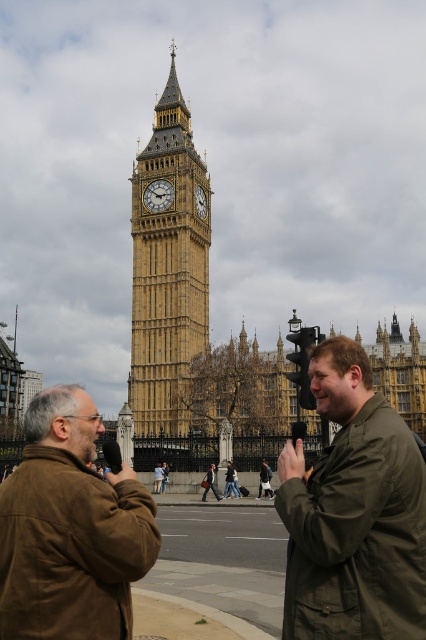
Question: Can you confirm if brown leather jacket at lower left is positioned above gold textured clock tower at center?

Choices:
 (A) no
 (B) yes

Answer: (A)

Question: Which is farther from the gold textured clock tower at center?

Choices:
 (A) gold/yellow stone clock tower at center
 (B) golden stone clock tower at center
 (C) brown leather jacket at lower left
 (D) olive-green jacket at center-right

Answer: (D)

Question: Is olive-green jacket at center-right smaller than brown leather jacket at lower left?

Choices:
 (A) yes
 (B) no

Answer: (B)

Question: Which of the following is the closest to the observer?

Choices:
 (A) (199, 211)
 (B) (340, 608)
 (C) (155, 196)

Answer: (B)

Question: Can you confirm if brown leather jacket at lower left is positioned to the right of gold/yellow stone clock tower at center?

Choices:
 (A) yes
 (B) no

Answer: (B)

Question: Which point is closer to the camera?

Choices:
 (A) (193, 328)
 (B) (344, 488)

Answer: (B)